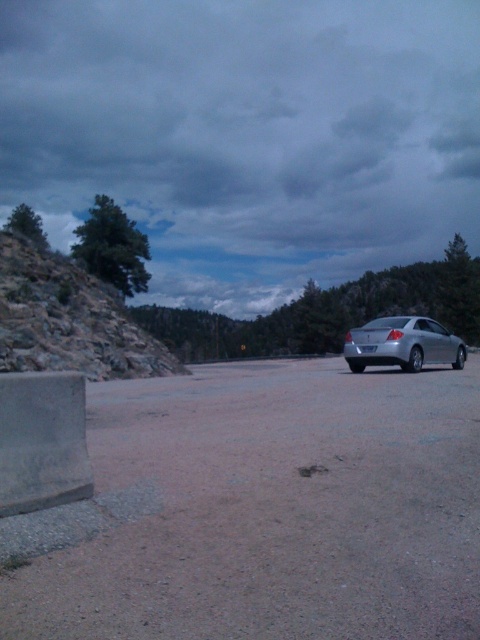
Looking at this image, you are driving a car and need to turn left onto the brown gravel dirt track at center from the silver metallic sedan at right. Is the track positioned to your left side?

Yes, the brown gravel dirt track at center is to the left of the silver metallic sedan at right, so turning left from the silver metallic sedan at right would lead you onto the track.

You are standing at the point marked as point (272, 509) on the image. What type of terrain are you currently standing on?

The point (272, 509) is on the brown gravel dirt track at center, so you are standing on a gravelly terrain.

You are driving a car and want to turn onto the brown gravel dirt track at center from the road you are currently on. The silver metallic sedan at right is parked on the same road. Is the dirt track closer to you than the sedan?

Yes, the brown gravel dirt track at center is closer to the viewer than the silver metallic sedan at right, so the dirt track is indeed closer.